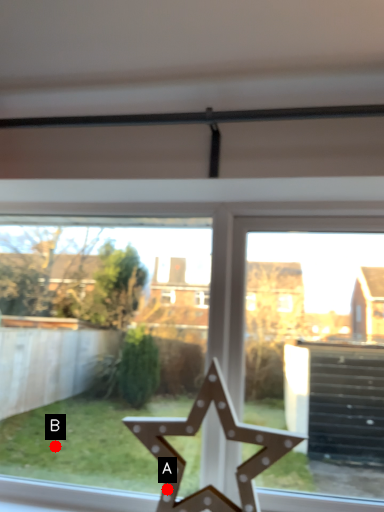
Question: Two points are circled on the image, labeled by A and B beside each circle. Which point is farther from the camera taking this photo?

Choices:
 (A) A is further
 (B) B is further

Answer: (B)